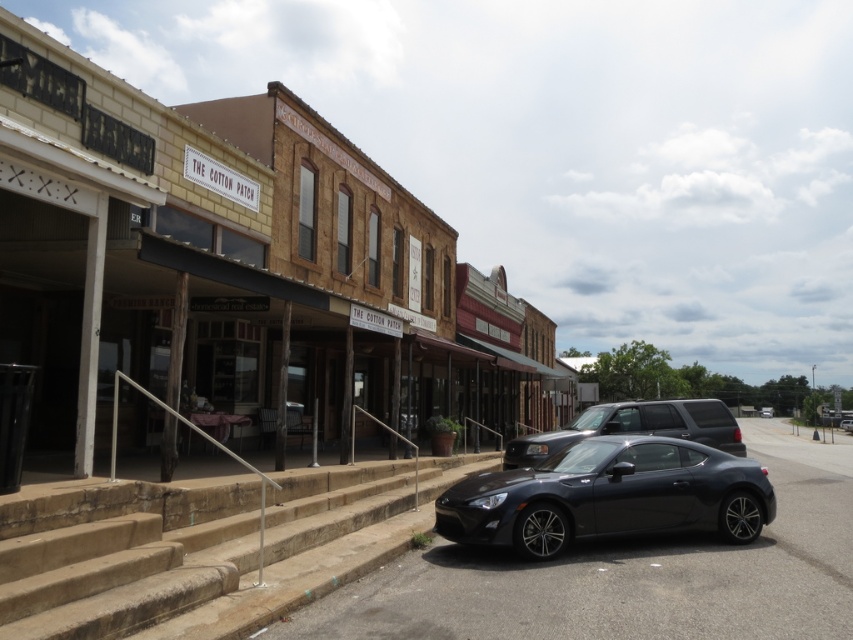
Based on the photo, who is taller, stone steps at center or shiny black car at center?

shiny black car at center

Which is more to the left, stone steps at center or shiny black car at center?

stone steps at center

Between point (45, 586) and point (759, 410), which one is positioned behind?

Point (759, 410)

This screenshot has width=853, height=640. In order to click on stone steps at center in this screenshot , I will do `click(196, 547)`.

In the scene shown: Who is shorter, satin black car at center or shiny black car at center?

With less height is shiny black car at center.

What are the coordinates of `satin black car at center` in the screenshot? It's located at (634, 428).

How much distance is there between glossy black car at lower center and satin black car at center?

glossy black car at lower center is 5.28 meters away from satin black car at center.

Is glossy black car at lower center wider than satin black car at center?

Incorrect, glossy black car at lower center's width does not surpass satin black car at center's.

Is point (695, 472) farther from camera compared to point (728, 417)?

No.

Identify the location of glossy black car at lower center. The height and width of the screenshot is (640, 853). (608, 497).